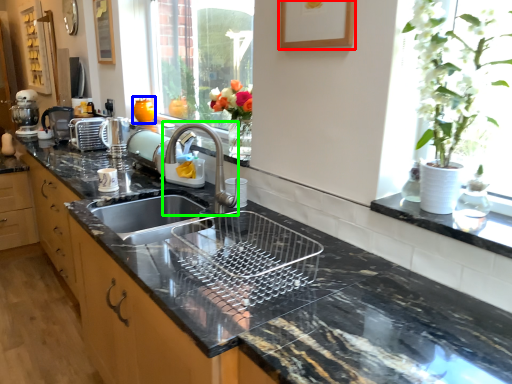
Question: Which object is positioned farthest from picture frame (highlighted by a red box)? Select from vase (highlighted by a blue box) and tap (highlighted by a green box).

Choices:
 (A) vase
 (B) tap

Answer: (A)